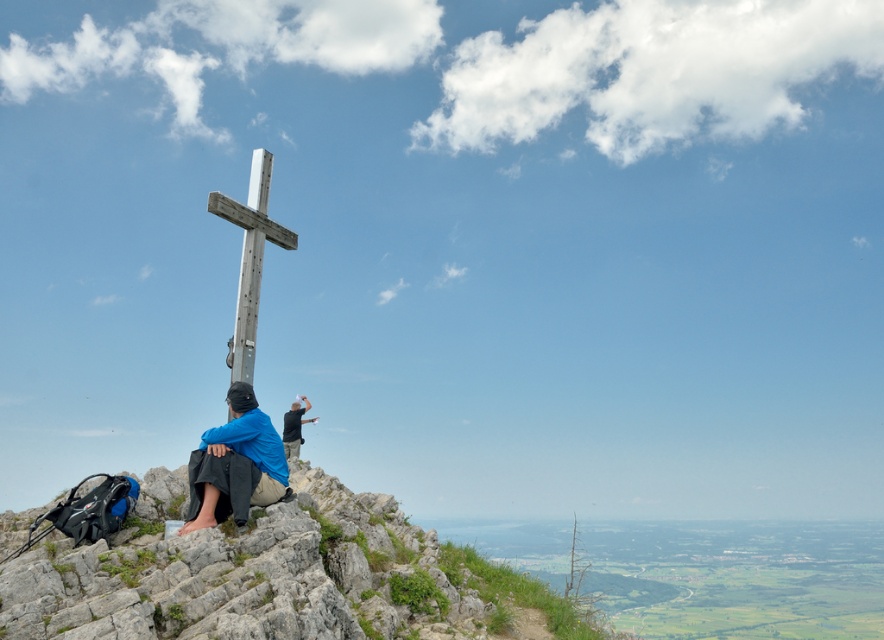
Is point (244, 458) positioned before point (211, 202)?

That is True.

Does blue fabric pants at lower left appear under metallic silver cross at center?

Yes.

Is point (265, 422) in front of point (245, 365)?

Yes, it is.

The width and height of the screenshot is (884, 640). I want to click on blue fabric pants at lower left, so click(x=235, y=465).

Is gray rocky hillside at lower left taller than metallic silver cross at center?

In fact, gray rocky hillside at lower left may be shorter than metallic silver cross at center.

Who is lower down, gray rocky hillside at lower left or metallic silver cross at center?

gray rocky hillside at lower left

The image size is (884, 640). Identify the location of gray rocky hillside at lower left. (276, 577).

Is gray rocky hillside at lower left taller than blue fabric pants at lower left?

Yes.

This screenshot has width=884, height=640. Describe the element at coordinates (276, 577) in the screenshot. I see `gray rocky hillside at lower left` at that location.

At what (x,y) coordinates should I click in order to perform the action: click on gray rocky hillside at lower left. Please return your answer as a coordinate pair (x, y). The image size is (884, 640). Looking at the image, I should click on (276, 577).